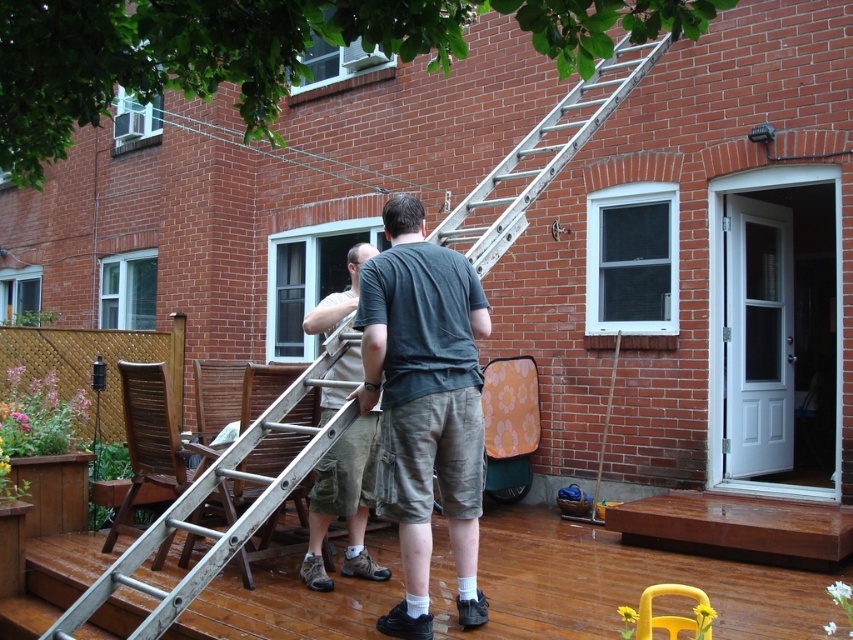
Does wooden at lower left have a lesser height compared to khaki cotton shorts at center?

Indeed, wooden at lower left has a lesser height compared to khaki cotton shorts at center.

Is wooden at lower left to the right of khaki cotton shorts at center from the viewer's perspective?

Indeed, wooden at lower left is positioned on the right side of khaki cotton shorts at center.

Does point (753, 621) lie in front of point (314, 317)?

Yes.

The width and height of the screenshot is (853, 640). Find the location of `wooden at lower left`. wooden at lower left is located at coordinates (613, 582).

Does wooden at lower left have a larger size compared to dark gray t-shirt at center?

Actually, wooden at lower left might be smaller than dark gray t-shirt at center.

Can you confirm if wooden at lower left is thinner than dark gray t-shirt at center?

In fact, wooden at lower left might be wider than dark gray t-shirt at center.

What do you see at coordinates (613, 582) in the screenshot? Image resolution: width=853 pixels, height=640 pixels. I see `wooden at lower left` at bounding box center [613, 582].

Find the location of a particular element. The height and width of the screenshot is (640, 853). wooden at lower left is located at coordinates (613, 582).

In the scene shown: Which is below, dark gray t-shirt at center or silver metallic ladder at center?

dark gray t-shirt at center is below.

Which is in front, point (399, 541) or point (152, 616)?

Positioned in front is point (152, 616).

Identify the location of dark gray t-shirt at center. click(x=424, y=404).